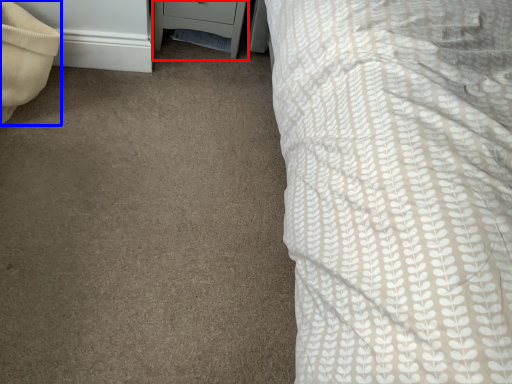
Question: Among these objects, which one is nearest to the camera, nightstand (highlighted by a red box) or pillow (highlighted by a blue box)?

Choices:
 (A) nightstand
 (B) pillow

Answer: (B)